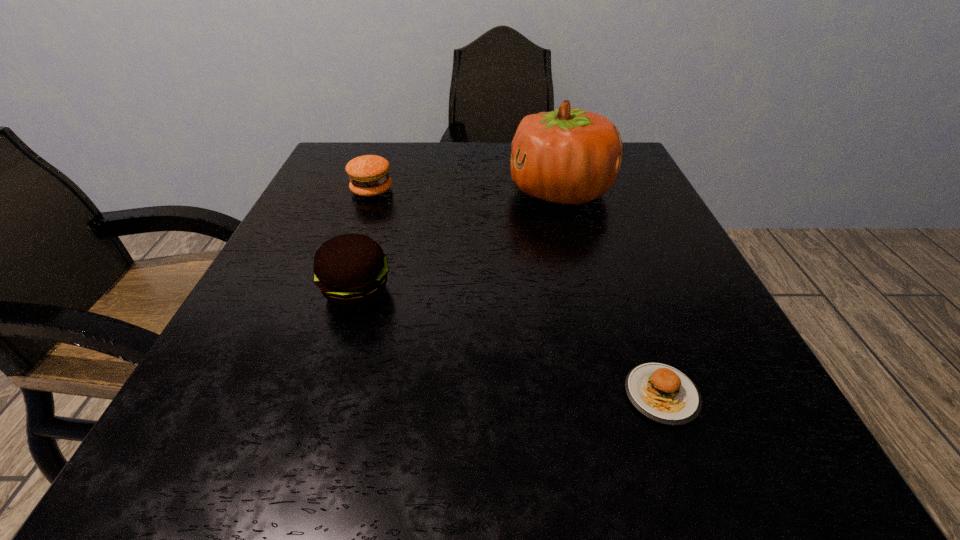
Where is `the tallest object`? This screenshot has width=960, height=540. the tallest object is located at coordinates (570, 156).

Image resolution: width=960 pixels, height=540 pixels. I want to click on the second nearest object, so click(x=351, y=270).

Where is `the tallest food`? the tallest food is located at coordinates (351, 270).

At what (x,y) coordinates should I click in order to perform the action: click on the second shortest food. Please return your answer as a coordinate pair (x, y). Image resolution: width=960 pixels, height=540 pixels. Looking at the image, I should click on (368, 174).

Where is `the third tallest object`? The height and width of the screenshot is (540, 960). the third tallest object is located at coordinates (368, 174).

At what (x,y) coordinates should I click in order to perform the action: click on the shortest object. Please return your answer as a coordinate pair (x, y). Looking at the image, I should click on (662, 393).

This screenshot has height=540, width=960. I want to click on the shortest food, so click(x=662, y=393).

Locate an element on the screen. free spot located 0.050m on the side of the tallest object with the cute face is located at coordinates (486, 192).

Locate an element on the screen. Image resolution: width=960 pixels, height=540 pixels. vacant space positioned 0.260m on the side of the tallest object with the cute face is located at coordinates (389, 192).

I want to click on free space located 0.240m on the side of the tallest object with the cute face, so tap(398, 192).